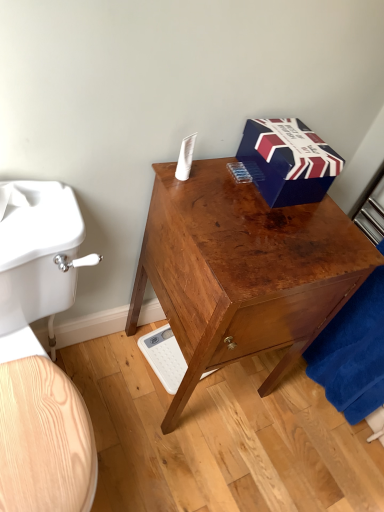
Question: From a real-world perspective, is white plastic scale at lower center above or below white matte toilet paper at upper center?

Choices:
 (A) below
 (B) above

Answer: (A)

Question: Is white plastic scale at lower center taller or shorter than white matte toilet paper at upper center?

Choices:
 (A) tall
 (B) short

Answer: (B)

Question: Which of these objects is positioned farthest from the blue cardboard box at upper right?

Choices:
 (A) shiny brown wooden desk at center
 (B) white matte toilet paper at upper center
 (C) light wood toilet at left
 (D) velvety blue towel at lower right
 (E) white plastic scale at lower center

Answer: (E)

Question: Estimate the real-world distances between objects in this image. Which object is closer to the white plastic scale at lower center?

Choices:
 (A) white matte toilet paper at upper center
 (B) shiny brown wooden desk at center
 (C) blue cardboard box at upper right
 (D) velvety blue towel at lower right
 (E) light wood toilet at left

Answer: (B)